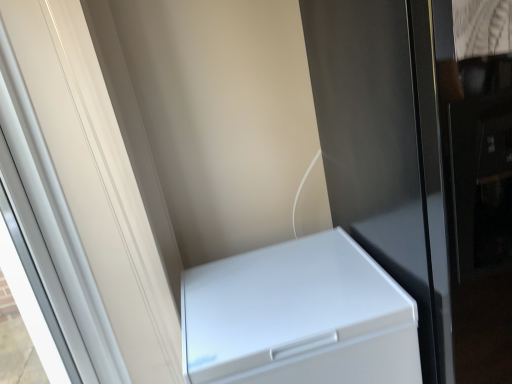
Question: Does glossy black screen door at lower right, which is the 2th screen door from left to right, come in front of white matte refrigerator at lower right?

Choices:
 (A) no
 (B) yes

Answer: (B)

Question: Could you tell me if glossy black screen door at lower right, the first screen door from the right, is turned towards white matte refrigerator at lower right?

Choices:
 (A) no
 (B) yes

Answer: (A)

Question: From a real-world perspective, is glossy black screen door at lower right, the first screen door from the right, physically below white matte refrigerator at lower right?

Choices:
 (A) no
 (B) yes

Answer: (A)

Question: From the image's perspective, is glossy black screen door at lower right, the first screen door from the right, on white matte refrigerator at lower right?

Choices:
 (A) no
 (B) yes

Answer: (B)

Question: Considering the relative sizes of glossy black screen door at lower right, the first screen door from the right, and white matte refrigerator at lower right in the image provided, is glossy black screen door at lower right, the first screen door from the right, taller than white matte refrigerator at lower right?

Choices:
 (A) yes
 (B) no

Answer: (A)

Question: Considering the relative sizes of glossy black screen door at lower right, the first screen door from the right, and white matte refrigerator at lower right in the image provided, is glossy black screen door at lower right, the first screen door from the right, smaller than white matte refrigerator at lower right?

Choices:
 (A) yes
 (B) no

Answer: (B)

Question: Can you confirm if white matte refrigerator at lower right is smaller than white glossy screen door at left, the 1th screen door from the left?

Choices:
 (A) no
 (B) yes

Answer: (A)

Question: Does white matte refrigerator at lower right have a lesser width compared to white glossy screen door at left, the 1th screen door from the left?

Choices:
 (A) no
 (B) yes

Answer: (A)

Question: Does white matte refrigerator at lower right turn towards white glossy screen door at left, the second screen door in the right-to-left sequence?

Choices:
 (A) no
 (B) yes

Answer: (A)

Question: Considering the relative sizes of white matte refrigerator at lower right and white glossy screen door at left, the 1th screen door from the left, in the image provided, is white matte refrigerator at lower right bigger than white glossy screen door at left, the 1th screen door from the left,?

Choices:
 (A) no
 (B) yes

Answer: (B)

Question: Would you say white glossy screen door at left, the 1th screen door from the left, is part of white matte refrigerator at lower right's contents?

Choices:
 (A) no
 (B) yes

Answer: (A)

Question: Is white matte refrigerator at lower right taller than white glossy screen door at left, the 1th screen door from the left?

Choices:
 (A) yes
 (B) no

Answer: (B)

Question: From the image's perspective, does white glossy screen door at left, the second screen door in the right-to-left sequence, appear lower than white matte refrigerator at lower right?

Choices:
 (A) yes
 (B) no

Answer: (B)